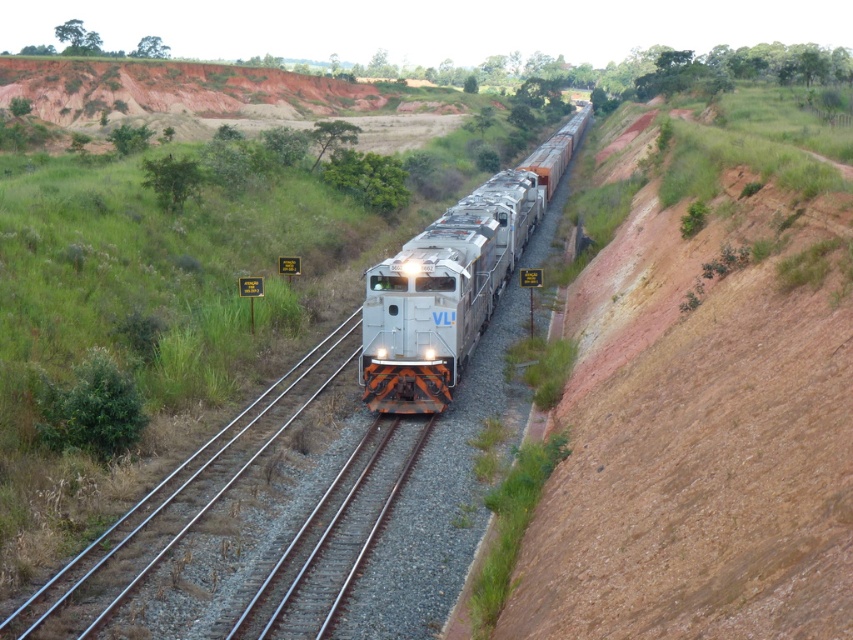
Can you confirm if silver metallic train at center is wider than metal/smooth train track at center?

Indeed, silver metallic train at center has a greater width compared to metal/smooth train track at center.

Is silver metallic train at center taller than metal/smooth train track at center?

Correct, silver metallic train at center is much taller as metal/smooth train track at center.

Between point (502, 196) and point (283, 611), which one is positioned behind?

Positioned behind is point (502, 196).

Identify the location of silver metallic train at center. Image resolution: width=853 pixels, height=640 pixels. (451, 282).